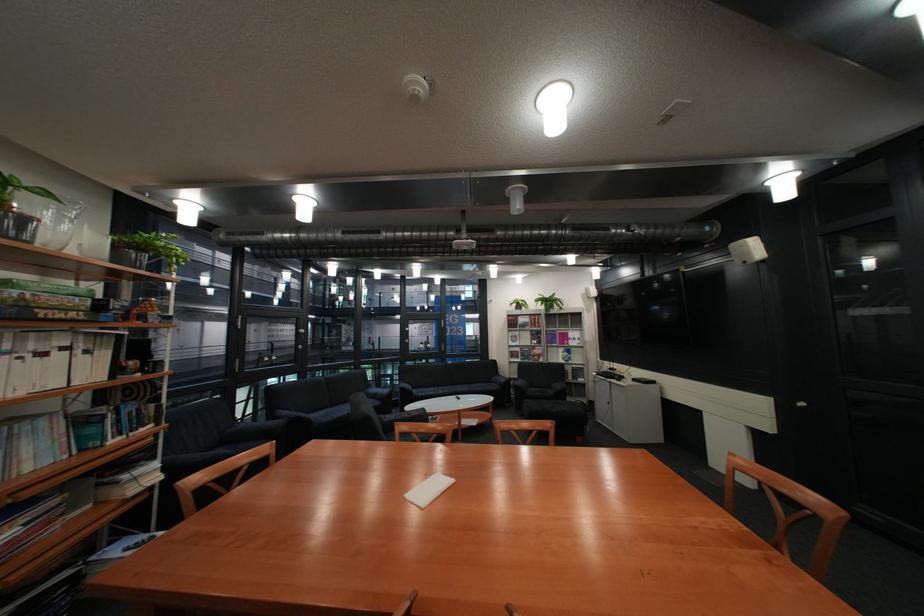
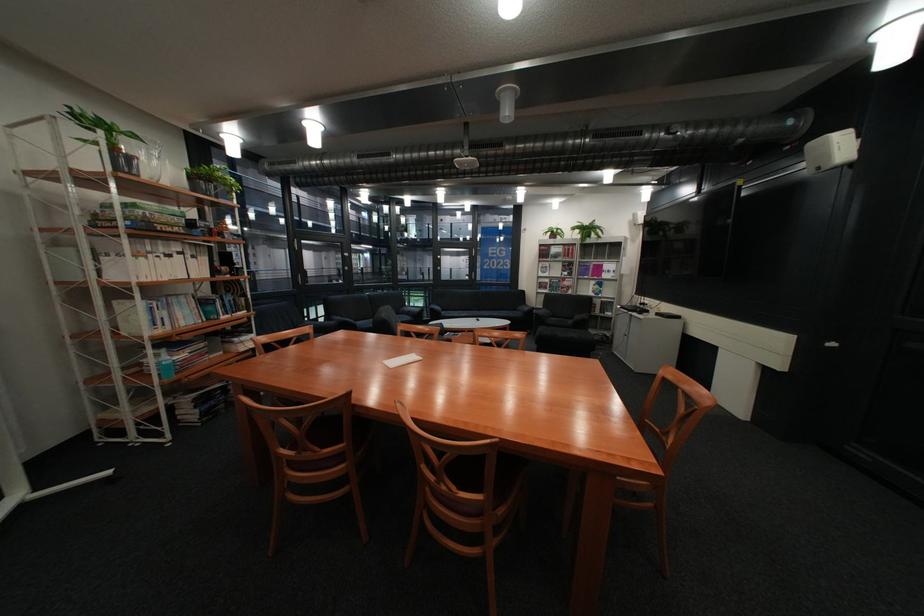
Locate, in the second image, the point that corresponds to the point at 43,243 in the first image.

(152, 177)